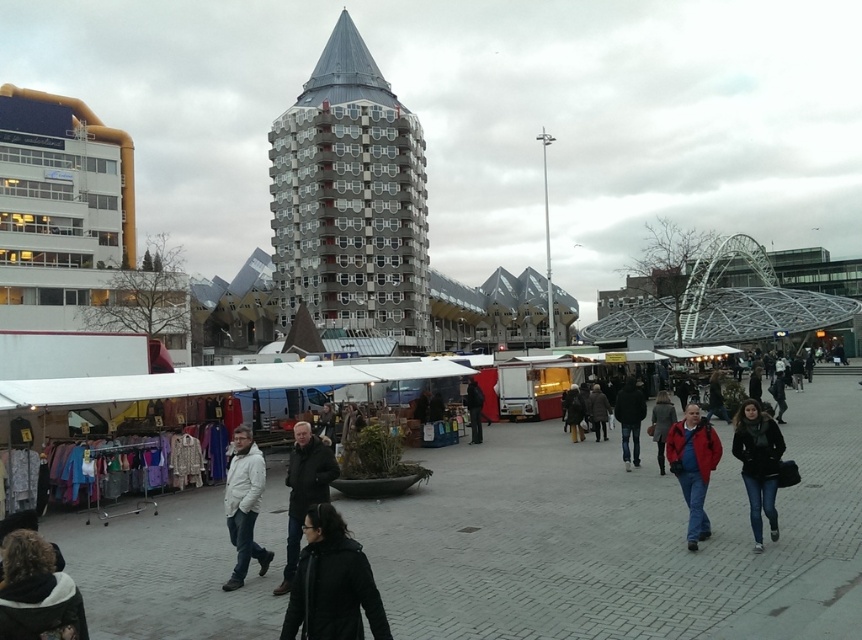
Question: Does jeans at center appear over black matte jacket at center?

Choices:
 (A) yes
 (B) no

Answer: (B)

Question: Is jeans at center bigger than black leather jacket at center?

Choices:
 (A) no
 (B) yes

Answer: (B)

Question: Is dark brown leather jacket at center closer to camera compared to white matte jacket at center?

Choices:
 (A) yes
 (B) no

Answer: (A)

Question: Which object is the farthest from the black fuzzy coat at center?

Choices:
 (A) black matte jacket at center
 (B) jeans at center
 (C) red jacket at center
 (D) black leather jacket at center

Answer: (D)

Question: Which of the following is the closest to the observer?

Choices:
 (A) black leather jacket at center
 (B) red jacket at center

Answer: (B)

Question: Which object is the closest to the white matte jacket at center?

Choices:
 (A) black fuzzy coat at center
 (B) jeans at center

Answer: (A)